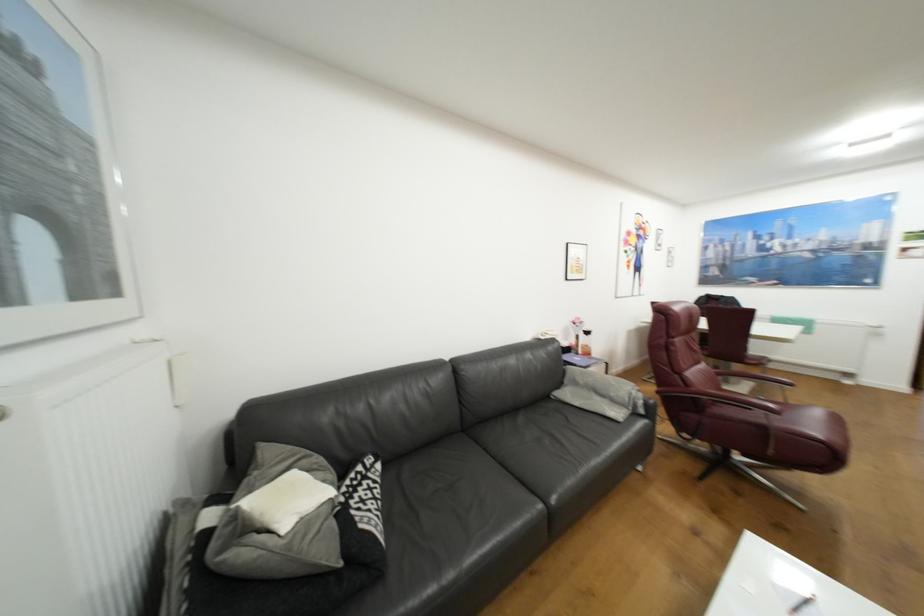
This screenshot has width=924, height=616. Describe the element at coordinates (797, 419) in the screenshot. I see `the red chair sitting surface` at that location.